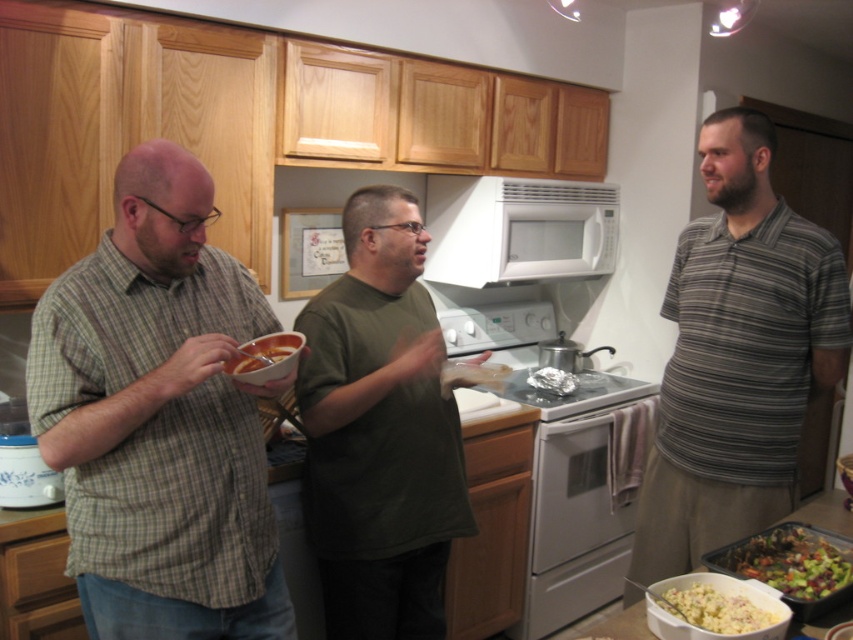
Is point (106, 237) positioned before point (345, 449)?

Yes, point (106, 237) is closer to viewer.

Does point (253, 529) lie behind point (318, 516)?

No.

The width and height of the screenshot is (853, 640). Identify the location of green plaid shirt at left. (160, 419).

Does green plaid shirt at left have a greater height compared to white matte microwave at upper center?

Indeed, green plaid shirt at left has a greater height compared to white matte microwave at upper center.

Does point (286, 600) come in front of point (457, 276)?

Yes.

Locate an element on the screen. The width and height of the screenshot is (853, 640). green plaid shirt at left is located at coordinates (160, 419).

Is green plaid shirt at left to the left of green leafy salad at lower right from the viewer's perspective?

Correct, you'll find green plaid shirt at left to the left of green leafy salad at lower right.

Between green plaid shirt at left and green leafy salad at lower right, which one has less height?

With less height is green leafy salad at lower right.

Which is behind, point (138, 182) or point (819, 531)?

The point (819, 531) is more distant.

Where is `green plaid shirt at left`? This screenshot has width=853, height=640. green plaid shirt at left is located at coordinates click(x=160, y=419).